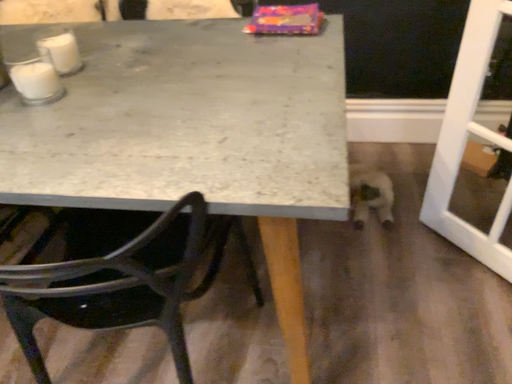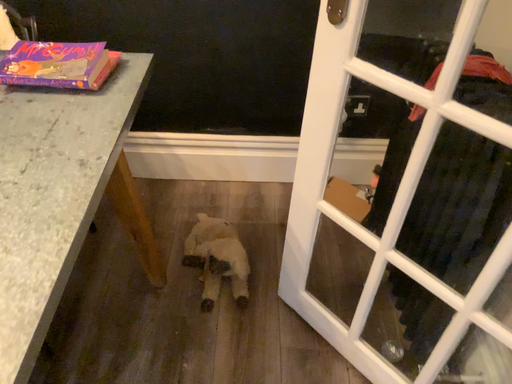
Question: How did the camera likely rotate when shooting the video?

Choices:
 (A) rotated right
 (B) rotated left

Answer: (A)